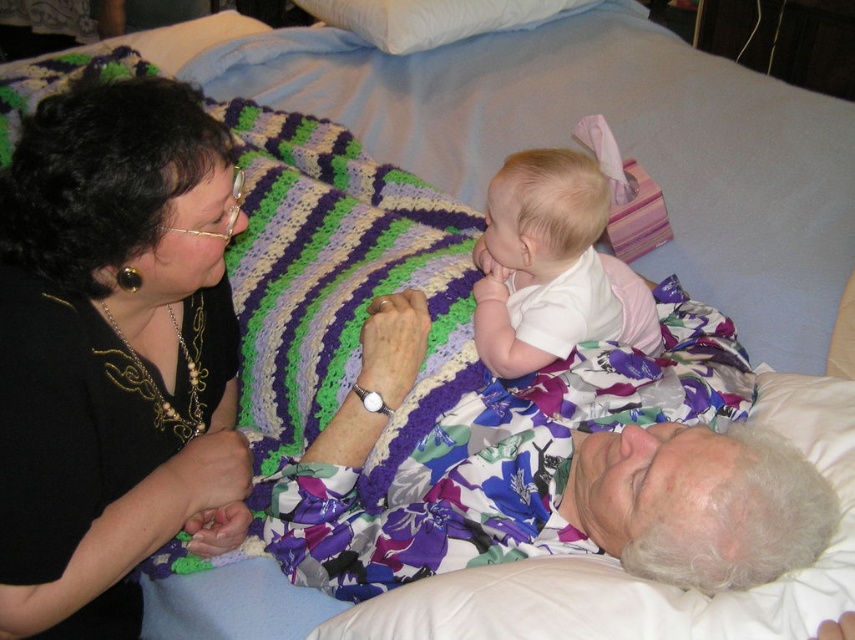
Does black fabric at upper left have a lesser height compared to white soft baby at center?

In fact, black fabric at upper left may be taller than white soft baby at center.

Can you confirm if black fabric at upper left is wider than white soft baby at center?

In fact, black fabric at upper left might be narrower than white soft baby at center.

Identify the location of black fabric at upper left. The height and width of the screenshot is (640, 855). coord(115,353).

I want to click on black fabric at upper left, so click(x=115, y=353).

Which is above, white soft baby at center or white soft pillow at upper center?

white soft pillow at upper center is above.

Between white soft baby at center and white soft pillow at upper center, which one has less height?

white soft pillow at upper center is shorter.

Where is `white soft baby at center`? Image resolution: width=855 pixels, height=640 pixels. white soft baby at center is located at coordinates pyautogui.click(x=551, y=266).

Does point (150, 138) come in front of point (441, 8)?

Yes, point (150, 138) is closer to viewer.

Is point (124, 147) more distant than point (582, 3)?

No, (124, 147) is closer to viewer.

What do you see at coordinates (115, 353) in the screenshot?
I see `black fabric at upper left` at bounding box center [115, 353].

Where is `black fabric at upper left`? black fabric at upper left is located at coordinates (115, 353).